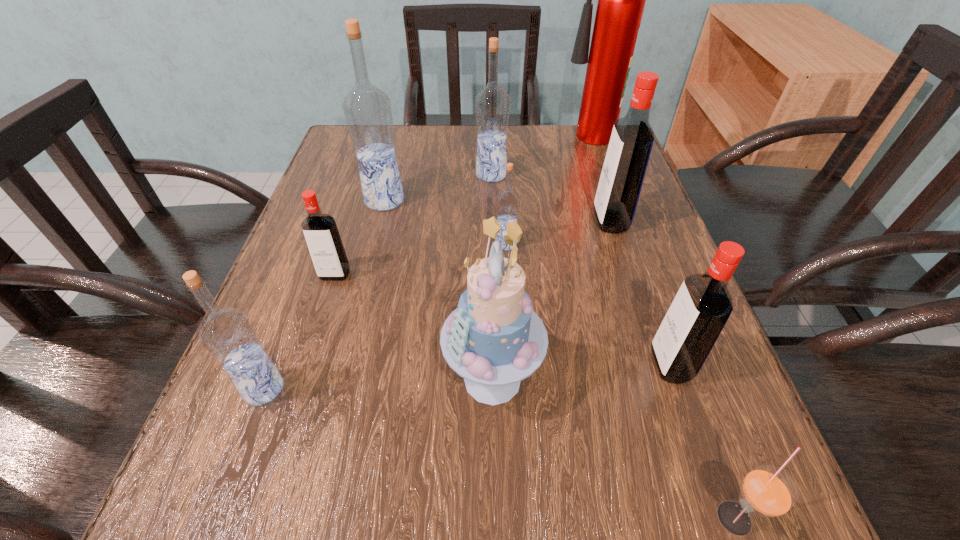
Locate an element on the screen. The width and height of the screenshot is (960, 540). free space located 0.160m on the front and back of the sixth farthest object is located at coordinates (308, 356).

The image size is (960, 540). Identify the location of free space located 0.240m on the back of the smallest blue vodka. (501, 171).

Identify the location of fire extinguisher that is at the far edge. click(x=621, y=0).

Locate an element on the screen. This screenshot has height=540, width=960. vodka positioned at the far edge is located at coordinates (492, 103).

The width and height of the screenshot is (960, 540). Identify the location of fire extinguisher that is at the right edge. (621, 0).

Find the location of `object positioned at the far right corner`. object positioned at the far right corner is located at coordinates (621, 0).

This screenshot has height=540, width=960. What are the coordinates of `free space at the near edge` in the screenshot? It's located at (453, 504).

Where is `vacant region at the left edge of the desktop`? Image resolution: width=960 pixels, height=540 pixels. vacant region at the left edge of the desktop is located at coordinates (296, 292).

Image resolution: width=960 pixels, height=540 pixels. I want to click on vacant space at the right edge of the desktop, so click(660, 317).

I want to click on free space between the sixth farthest object and the farthest vodka, so click(413, 225).